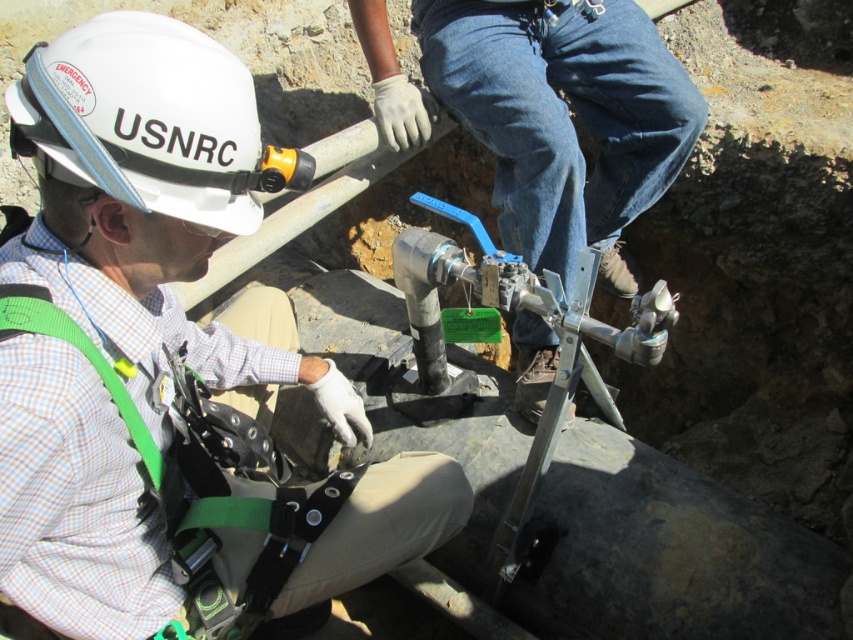
You are navigating through the construction site and need to reach the control panel located at point A, which is at coordinates point (x=457, y=8). However, there is an obstacle at point B, which is at coordinates point (x=109, y=26). Based on the spatial relationship between these two points, which direction should you move to avoid the obstacle and reach the control panel?

Point (x=457, y=8) is behind point (x=109, y=26), so you should move behind the obstacle at point (x=109, y=26) to reach the control panel at point (x=457, y=8).

You are a safety inspector at the construction site. You need to ensure that all tools and equipment are kept at least 1.2 meters away from the white hard hat at upper left for safety reasons. Is the metallic silver valve at center compliant with this requirement?

The metallic silver valve at center is 1.18 meters away from the white hard hat at upper left, which is less than the required 1.2 meters. Therefore, it does not comply with the safety requirement.